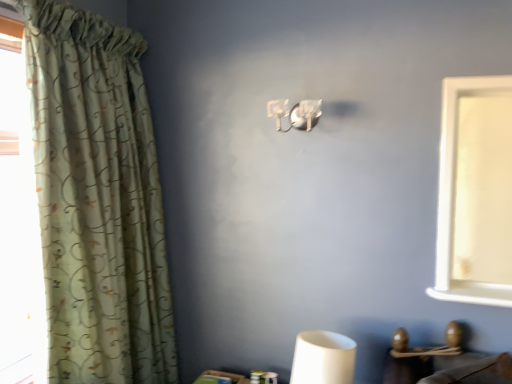
Question: Does green floral fabric curtain at left come in front of satin silver sconce at upper center?

Choices:
 (A) yes
 (B) no

Answer: (A)

Question: Is green floral fabric curtain at left looking in the opposite direction of satin silver sconce at upper center?

Choices:
 (A) no
 (B) yes

Answer: (A)

Question: Considering the relative sizes of green floral fabric curtain at left and satin silver sconce at upper center in the image provided, is green floral fabric curtain at left thinner than satin silver sconce at upper center?

Choices:
 (A) yes
 (B) no

Answer: (B)

Question: From a real-world perspective, is green floral fabric curtain at left physically below satin silver sconce at upper center?

Choices:
 (A) no
 (B) yes

Answer: (B)

Question: Is green floral fabric curtain at left outside of satin silver sconce at upper center?

Choices:
 (A) yes
 (B) no

Answer: (A)

Question: From the image's perspective, would you say green floral fabric curtain at left is positioned over satin silver sconce at upper center?

Choices:
 (A) yes
 (B) no

Answer: (B)

Question: From the image's perspective, is satin silver sconce at upper center beneath green floral fabric curtain at left?

Choices:
 (A) no
 (B) yes

Answer: (A)

Question: Is satin silver sconce at upper center at the left side of green floral fabric curtain at left?

Choices:
 (A) yes
 (B) no

Answer: (B)

Question: Is the depth of satin silver sconce at upper center less than that of green floral fabric curtain at left?

Choices:
 (A) no
 (B) yes

Answer: (A)

Question: Is satin silver sconce at upper center far away from green floral fabric curtain at left?

Choices:
 (A) yes
 (B) no

Answer: (B)

Question: From the image's perspective, is satin silver sconce at upper center on green floral fabric curtain at left?

Choices:
 (A) yes
 (B) no

Answer: (A)

Question: Does satin silver sconce at upper center have a smaller size compared to green floral fabric curtain at left?

Choices:
 (A) yes
 (B) no

Answer: (A)

Question: Based on their sizes in the image, would you say satin silver sconce at upper center is bigger or smaller than green floral fabric curtain at left?

Choices:
 (A) small
 (B) big

Answer: (A)